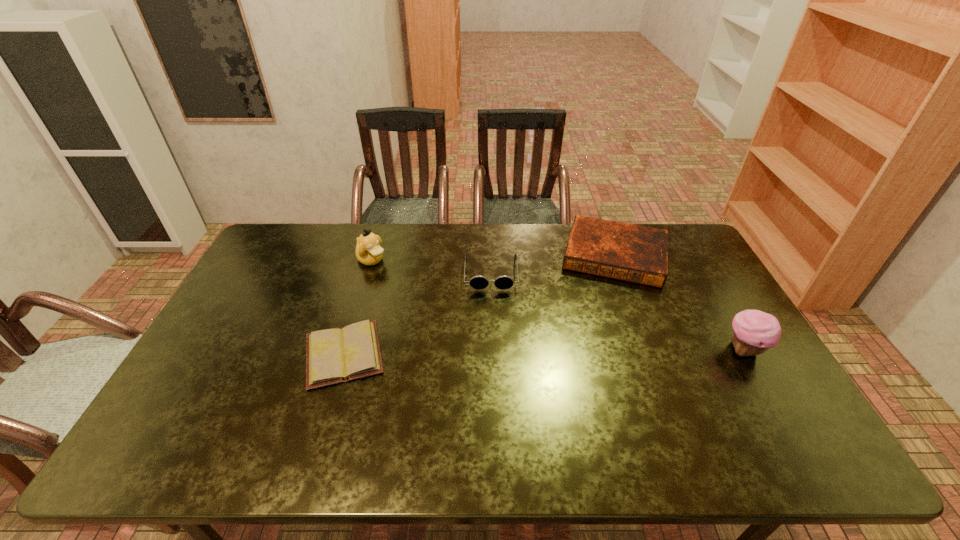
Identify the location of free space on the desktop that is between the shortest object and the rightmost object and is positioned on the spine side of the Bible. The image size is (960, 540). (601, 352).

The width and height of the screenshot is (960, 540). I want to click on free spot on the desktop that is between the diary and the cupcake and is positioned on the face of the duckling, so click(505, 353).

Where is `free space on the desktop that is between the shortest object and the rightmost object and is positioned on the front-facing side of the sunglasses`? Image resolution: width=960 pixels, height=540 pixels. free space on the desktop that is between the shortest object and the rightmost object and is positioned on the front-facing side of the sunglasses is located at coordinates (492, 353).